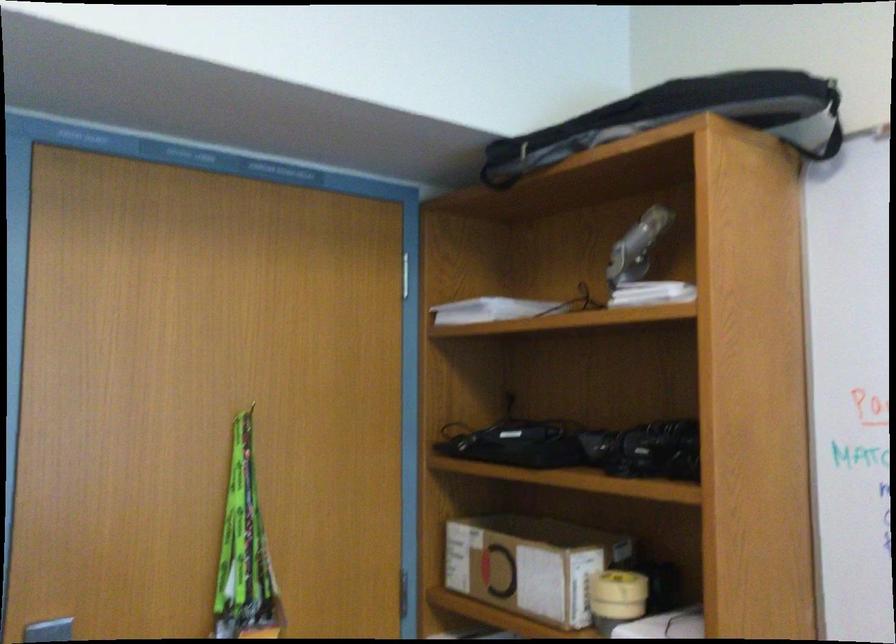
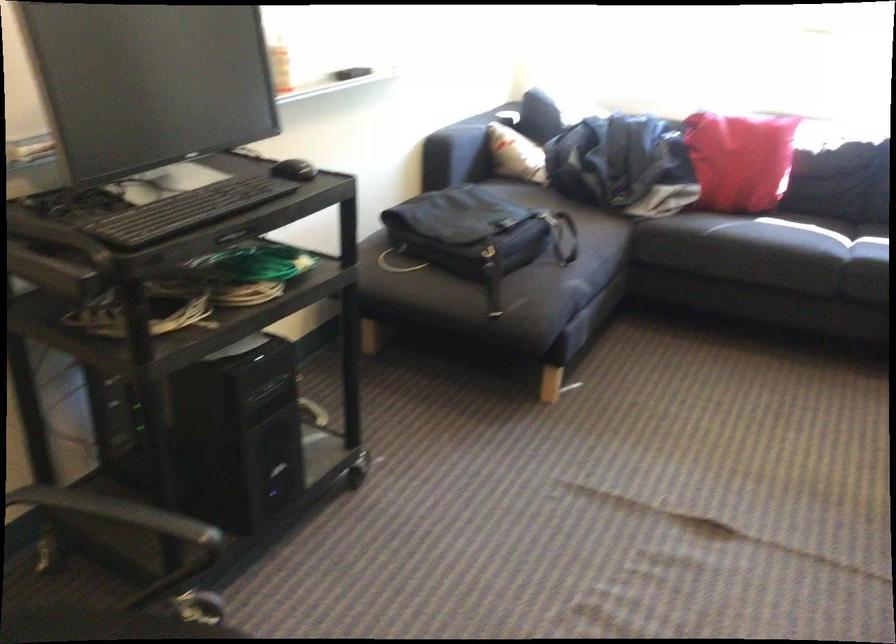
The images are taken continuously from a first-person perspective. In which direction is your viewpoint rotating?

The rotation direction of the camera is right-down.